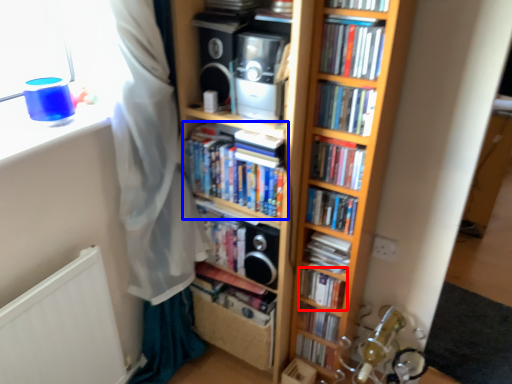
Question: Which point is further to the camera, book (highlighted by a red box) or book (highlighted by a blue box)?

Choices:
 (A) book
 (B) book

Answer: (A)